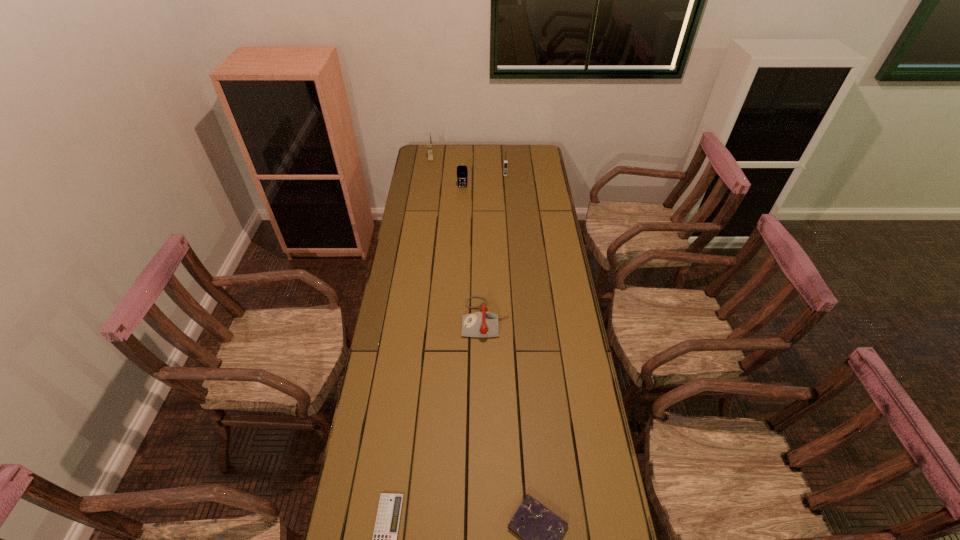
What are the coordinates of `the farthest object` in the screenshot? It's located at (429, 144).

Identify the location of the leftmost cellular telephone. Image resolution: width=960 pixels, height=540 pixels. (429, 144).

The image size is (960, 540). I want to click on the rightmost cellular telephone, so click(505, 161).

This screenshot has width=960, height=540. I want to click on the second nearest cellular telephone, so click(505, 161).

What are the coordinates of `the nearest cellular telephone` in the screenshot? It's located at (462, 172).

You are a GUI agent. You are given a task and a screenshot of the screen. Output one action in this format:
    pyautogui.click(x=<x>, y=<y>)
    Task: Click on the fourth nearest object
    
    Given the screenshot: What is the action you would take?
    pyautogui.click(x=462, y=172)

Locate an element on the screen. Image resolution: width=960 pixels, height=540 pixels. the third shortest object is located at coordinates (479, 324).

The height and width of the screenshot is (540, 960). Identify the location of telephone. (479, 324).

What are the coordinates of `free space located on the front of the tallest cellular telephone, where the keypad is located` in the screenshot? It's located at pyautogui.click(x=425, y=198).

Locate an element on the screen. blank space located 0.240m on the front-facing side of the rightmost cellular telephone is located at coordinates (x=507, y=202).